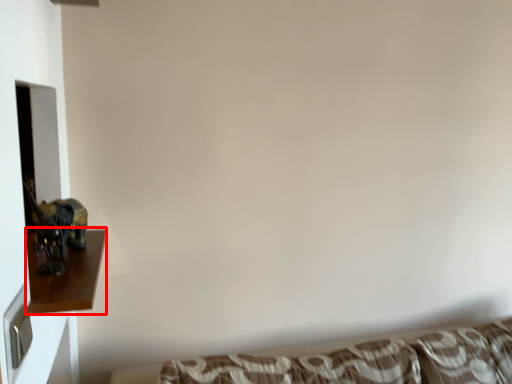
Question: Where is furniture (annotated by the red box) located in relation to studio couch in the image?

Choices:
 (A) right
 (B) left

Answer: (B)